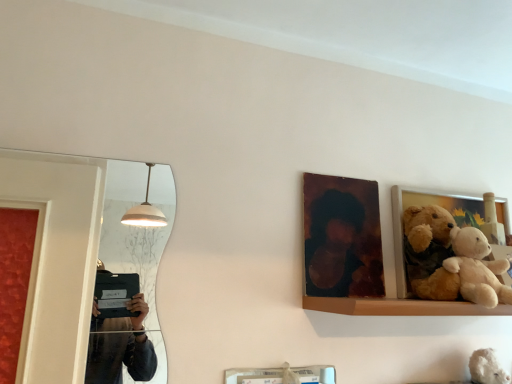
Question: Should I look upward or downward to see wooden picture frame at right, the 2th picture frame from the left?

Choices:
 (A) up
 (B) down

Answer: (B)

Question: Considering the relative sizes of wooden picture frame at right, the 2th picture frame from the left, and wooden photo frame at upper center, positioned as the second picture frame in right-to-left order, in the image provided, is wooden picture frame at right, the 2th picture frame from the left, thinner than wooden photo frame at upper center, positioned as the second picture frame in right-to-left order,?

Choices:
 (A) yes
 (B) no

Answer: (B)

Question: Is wooden picture frame at right, marked as the first picture frame in a right-to-left arrangement, positioned beyond the bounds of wooden photo frame at upper center, positioned as the second picture frame in right-to-left order?

Choices:
 (A) yes
 (B) no

Answer: (A)

Question: Is wooden picture frame at right, marked as the first picture frame in a right-to-left arrangement, smaller than wooden photo frame at upper center, the first picture frame positioned from the left?

Choices:
 (A) yes
 (B) no

Answer: (B)

Question: Can you confirm if wooden picture frame at right, marked as the first picture frame in a right-to-left arrangement, is taller than wooden photo frame at upper center, positioned as the second picture frame in right-to-left order?

Choices:
 (A) no
 (B) yes

Answer: (B)

Question: Is wooden photo frame at upper center, positioned as the second picture frame in right-to-left order, at the back of wooden picture frame at right, marked as the first picture frame in a right-to-left arrangement?

Choices:
 (A) yes
 (B) no

Answer: (B)

Question: Considering the relative sizes of wooden picture frame at right, the 2th picture frame from the left, and wooden photo frame at upper center, positioned as the second picture frame in right-to-left order, in the image provided, is wooden picture frame at right, the 2th picture frame from the left, wider than wooden photo frame at upper center, positioned as the second picture frame in right-to-left order,?

Choices:
 (A) yes
 (B) no

Answer: (A)

Question: Does wooden picture frame at right, marked as the first picture frame in a right-to-left arrangement, have a larger size compared to soft plush teddy bear at right?

Choices:
 (A) no
 (B) yes

Answer: (B)

Question: Can you confirm if wooden picture frame at right, marked as the first picture frame in a right-to-left arrangement, is smaller than soft plush teddy bear at right?

Choices:
 (A) yes
 (B) no

Answer: (B)

Question: Is wooden picture frame at right, the 2th picture frame from the left, taller than soft plush teddy bear at right?

Choices:
 (A) yes
 (B) no

Answer: (A)

Question: Is wooden picture frame at right, the 2th picture frame from the left, oriented away from soft plush teddy bear at right?

Choices:
 (A) no
 (B) yes

Answer: (A)

Question: Would you say soft plush teddy bear at right is part of wooden picture frame at right, the 2th picture frame from the left,'s contents?

Choices:
 (A) no
 (B) yes

Answer: (A)

Question: Considering the relative sizes of wooden picture frame at right, the 2th picture frame from the left, and white plush teddy bear at lower right in the image provided, is wooden picture frame at right, the 2th picture frame from the left, thinner than white plush teddy bear at lower right?

Choices:
 (A) no
 (B) yes

Answer: (B)